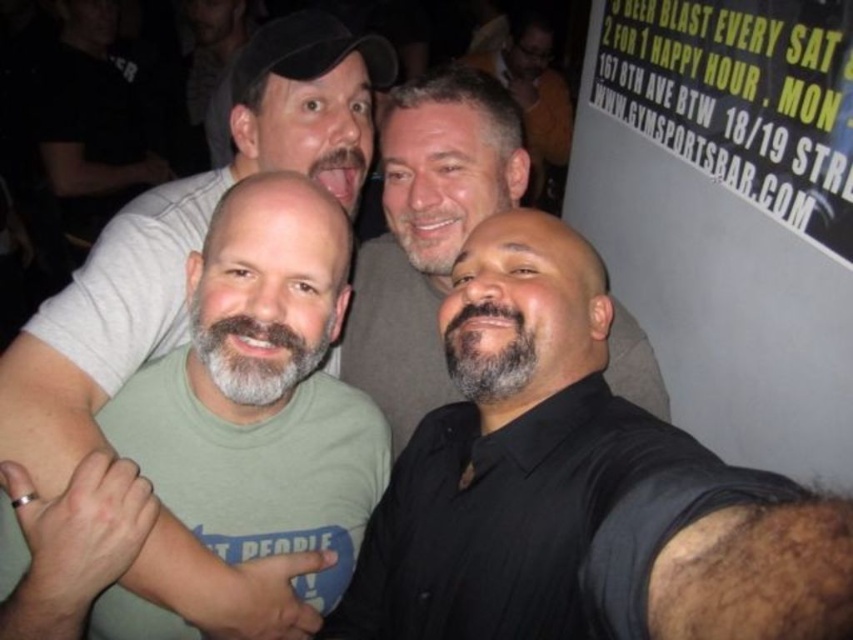
Question: Which point is closer to the camera?

Choices:
 (A) (621, 326)
 (B) (305, 211)

Answer: (B)

Question: Does green cotton t-shirt at center come in front of gray beard at center?

Choices:
 (A) no
 (B) yes

Answer: (B)

Question: Which object appears closest to the camera in this image?

Choices:
 (A) black shirt at center
 (B) black plastic signboard at upper right
 (C) green cotton t-shirt at center
 (D) gray beard at center

Answer: (A)

Question: Does black plastic signboard at upper right appear on the left side of gray beard at center?

Choices:
 (A) no
 (B) yes

Answer: (A)

Question: Does green cotton t-shirt at center appear on the right side of gray beard at center?

Choices:
 (A) no
 (B) yes

Answer: (A)

Question: Which point is farther to the camera?

Choices:
 (A) (779, 609)
 (B) (321, 436)
 (C) (670, 358)
 (D) (434, 300)

Answer: (C)